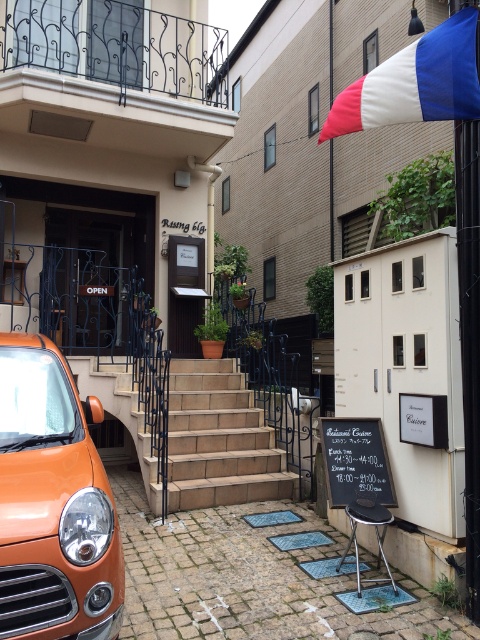
Question: Which point appears closest to the camera in this image?

Choices:
 (A) (300, 154)
 (B) (294, 483)
 (C) (92, 538)

Answer: (C)

Question: Does metallic gate at center appear on the left side of tricolor fabric flag at upper right?

Choices:
 (A) yes
 (B) no

Answer: (A)

Question: Among these points, which one is farthest from the camera?

Choices:
 (A) (11, 472)
 (B) (78, 221)
 (C) (368, 445)
 (D) (176, 396)

Answer: (B)

Question: Which object is positioned farthest from the orange matte car at left?

Choices:
 (A) tricolor fabric flag at upper right
 (B) black chalkboard at center
 (C) beige stone stairs at center
 (D) metallic gate at center

Answer: (D)

Question: Does french flag at upper right have a smaller size compared to tricolor fabric flag at upper right?

Choices:
 (A) no
 (B) yes

Answer: (A)

Question: Is metallic gate at center bigger than black chalkboard at center?

Choices:
 (A) no
 (B) yes

Answer: (B)